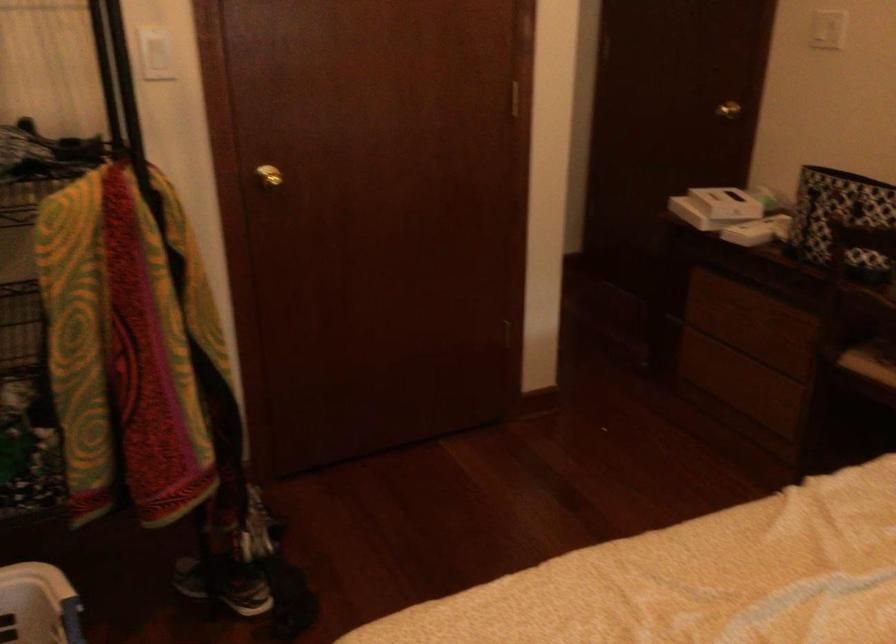
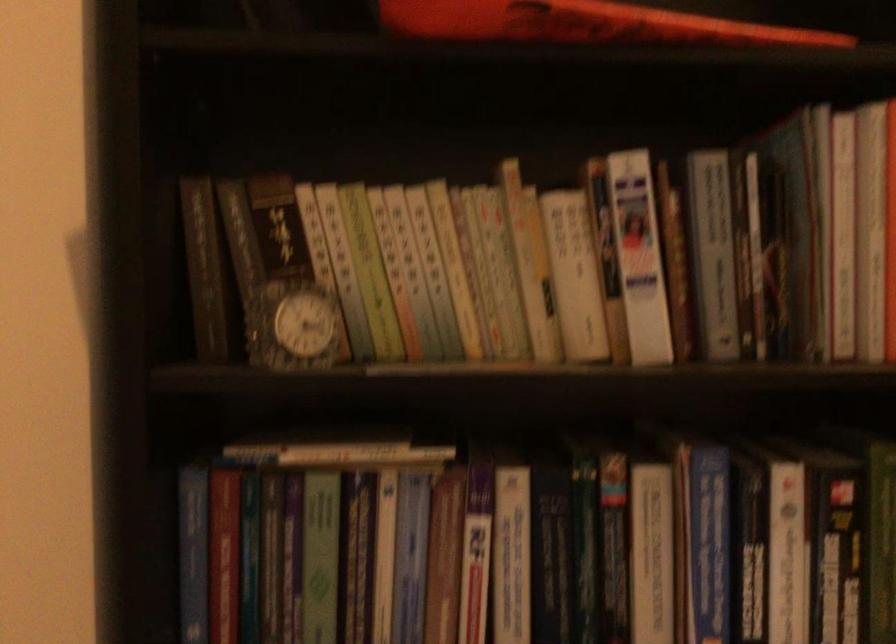
Question: The camera is either moving clockwise (left) or counter-clockwise (right) around the object. The first image is from the beginning of the video and the second image is from the end. Is the camera moving left or right when shooting the video?

Choices:
 (A) Left
 (B) Right

Answer: (B)